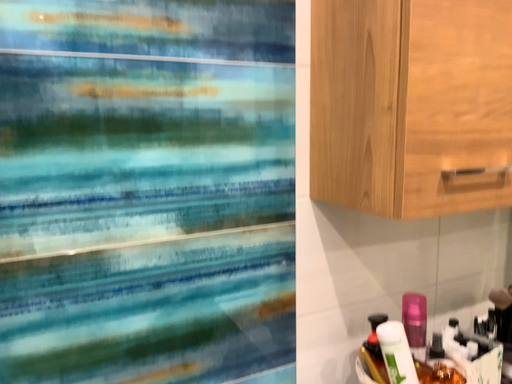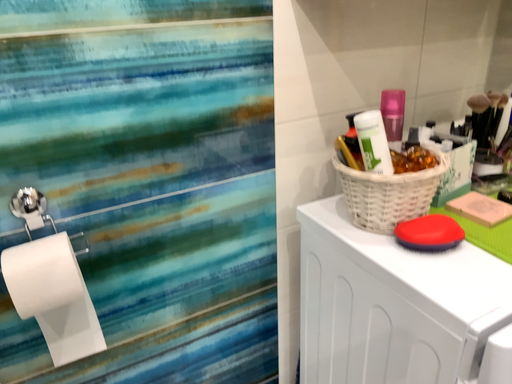
Question: Which way did the camera rotate in the video?

Choices:
 (A) rotated upward
 (B) rotated downward

Answer: (B)